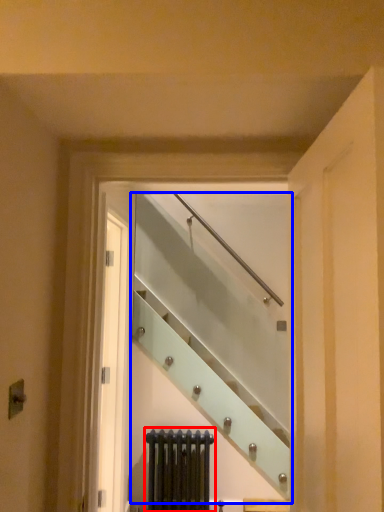
Question: Which of the following is the closest to the observer, radiator (highlighted by a red box) or escalator (highlighted by a blue box)?

Choices:
 (A) radiator
 (B) escalator

Answer: (B)